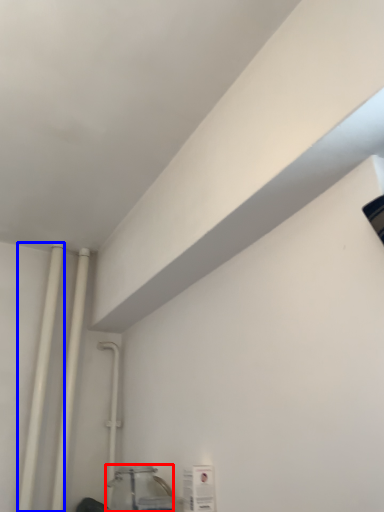
Question: Which object appears farthest to the camera in this image, glass jar (highlighted by a red box) or pipe (highlighted by a blue box)?

Choices:
 (A) glass jar
 (B) pipe

Answer: (B)